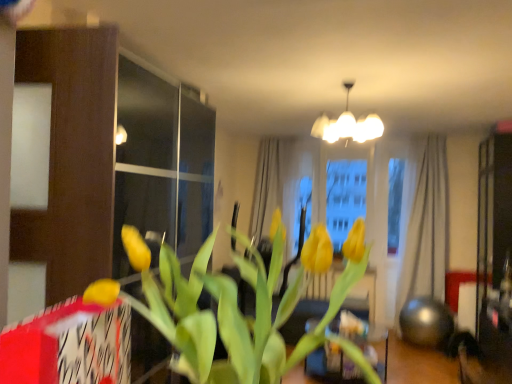
Question: Is yellow matte tulip at center not near white glossy chandelier at upper center?

Choices:
 (A) no
 (B) yes

Answer: (B)

Question: From the image's perspective, is yellow matte tulip at center below white glossy chandelier at upper center?

Choices:
 (A) yes
 (B) no

Answer: (A)

Question: From a real-world perspective, does yellow matte tulip at center stand above white glossy chandelier at upper center?

Choices:
 (A) no
 (B) yes

Answer: (A)

Question: Considering the relative sizes of yellow matte tulip at center and white glossy chandelier at upper center in the image provided, is yellow matte tulip at center taller than white glossy chandelier at upper center?

Choices:
 (A) yes
 (B) no

Answer: (B)

Question: Is yellow matte tulip at center aimed at white glossy chandelier at upper center?

Choices:
 (A) yes
 (B) no

Answer: (A)

Question: In terms of width, does white glossy chandelier at upper center look wider or thinner when compared to beige fabric curtain at right?

Choices:
 (A) thin
 (B) wide

Answer: (B)

Question: Is white glossy chandelier at upper center bigger or smaller than beige fabric curtain at right?

Choices:
 (A) small
 (B) big

Answer: (A)

Question: In the image, is white glossy chandelier at upper center on the left side or the right side of beige fabric curtain at right?

Choices:
 (A) left
 (B) right

Answer: (A)

Question: Is point (368, 137) positioned closer to the camera than point (420, 223)?

Choices:
 (A) farther
 (B) closer

Answer: (B)

Question: Relative to white glossy chandelier at upper center, is beige fabric curtain at right in front or behind?

Choices:
 (A) front
 (B) behind

Answer: (B)

Question: In terms of size, does beige fabric curtain at right appear bigger or smaller than white glossy chandelier at upper center?

Choices:
 (A) big
 (B) small

Answer: (A)

Question: From the image's perspective, is beige fabric curtain at right above or below white glossy chandelier at upper center?

Choices:
 (A) below
 (B) above

Answer: (A)

Question: From their relative heights in the image, would you say beige fabric curtain at right is taller or shorter than white glossy chandelier at upper center?

Choices:
 (A) short
 (B) tall

Answer: (B)

Question: Is point (412, 306) closer or farther from the camera than point (272, 344)?

Choices:
 (A) closer
 (B) farther

Answer: (B)

Question: Considering their positions, is beige fabric curtain at right located in front of or behind yellow matte tulip at center?

Choices:
 (A) front
 (B) behind

Answer: (B)